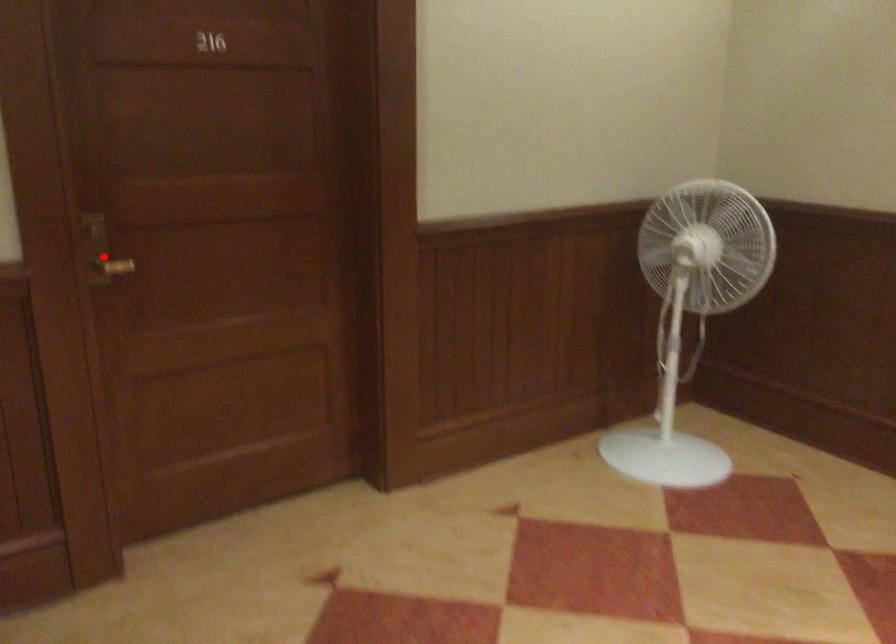
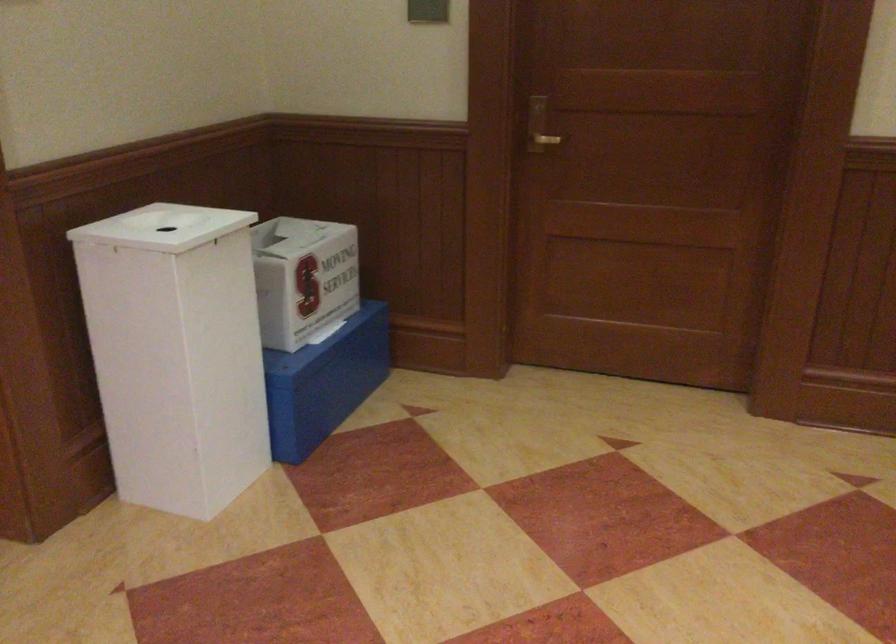
Question: I am providing you with two images of the same scene from different viewpoints. Given a red point in image1, look at the same physical point in image2. Is it:

Choices:
 (A) Closer to the viewpoint
 (B) Farther from the viewpoint

Answer: (B)